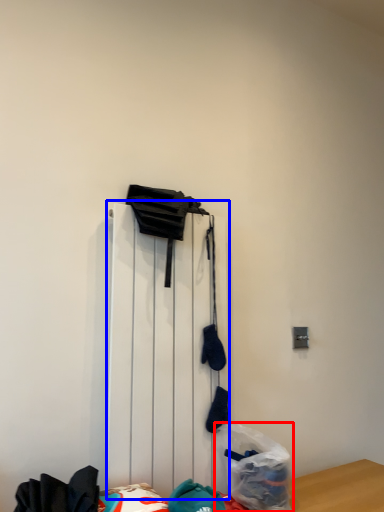
Question: Which object appears closest to the camera in this image, plastic bag (highlighted by a red box) or radiator (highlighted by a blue box)?

Choices:
 (A) plastic bag
 (B) radiator

Answer: (B)